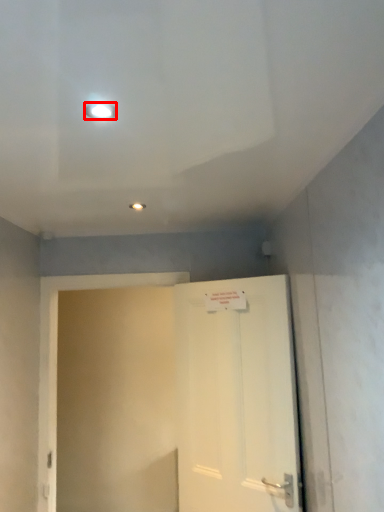
Question: In this image, where is lighting (annotated by the red box) located relative to door?

Choices:
 (A) right
 (B) left

Answer: (B)